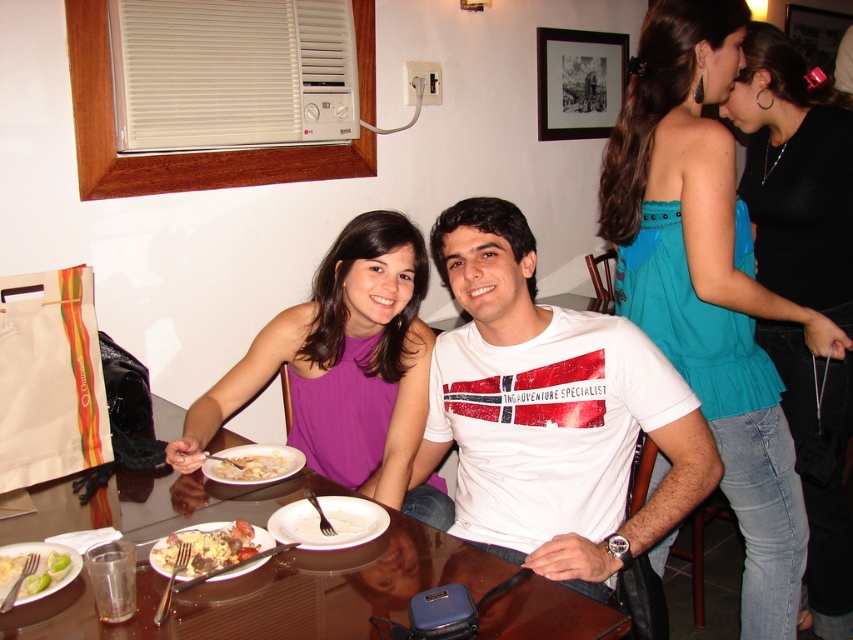
Is white cotton t-shirt at center above brown glossy table at center?

Correct, white cotton t-shirt at center is located above brown glossy table at center.

In order to click on white cotton t-shirt at center in this screenshot , I will do `click(549, 412)`.

I want to click on white cotton t-shirt at center, so click(x=549, y=412).

Can you confirm if teal satin blouse at upper right is taller than purple ribbed tank top at center?

Yes.

Does point (689, 188) come in front of point (437, 486)?

Yes, it is.

Between point (634, 93) and point (357, 488), which one is positioned in front?

Point (634, 93) is in front.

Find the location of a particular element. teal satin blouse at upper right is located at coordinates (709, 284).

Is white cotton t-shirt at center taller than teal satin blouse at upper right?

No.

Who is taller, white cotton t-shirt at center or teal satin blouse at upper right?

teal satin blouse at upper right is taller.

What do you see at coordinates (549, 412) in the screenshot?
I see `white cotton t-shirt at center` at bounding box center [549, 412].

Where is `white cotton t-shirt at center`? white cotton t-shirt at center is located at coordinates (549, 412).